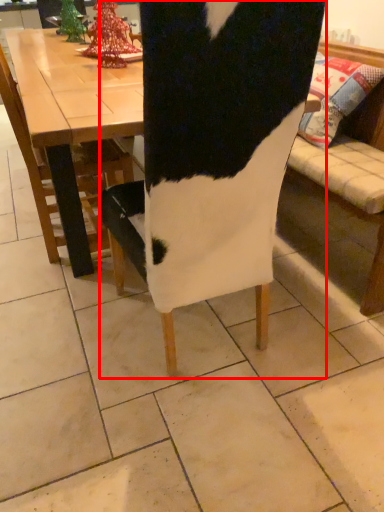
Question: From the image, what is the correct spatial relationship of chair (annotated by the red box) in relation to chair?

Choices:
 (A) right
 (B) left

Answer: (A)